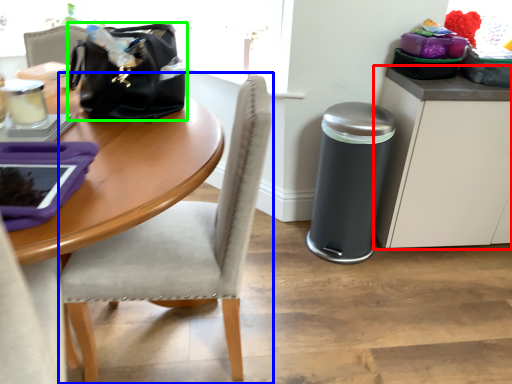
Question: Estimate the real-world distances between objects in this image. Which object is farther from cabinetry (highlighted by a red box), chair (highlighted by a blue box) or handbag (highlighted by a green box)?

Choices:
 (A) chair
 (B) handbag

Answer: (B)